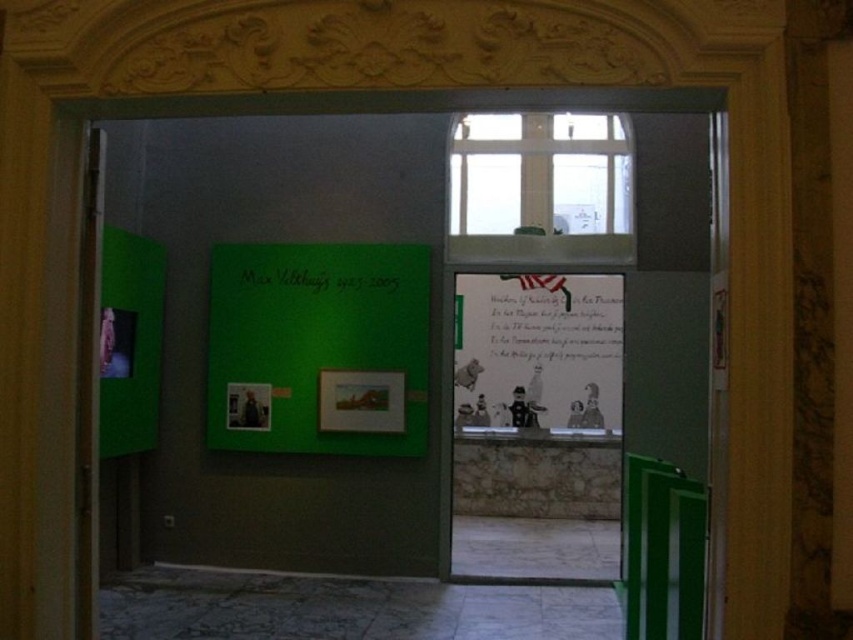
Who is lower down, handwritten paper at center or green matte sign at center?

handwritten paper at center is below.

Can you confirm if handwritten paper at center is thinner than green matte sign at center?

Incorrect, handwritten paper at center's width is not less than green matte sign at center's.

Where is `handwritten paper at center`? This screenshot has height=640, width=853. handwritten paper at center is located at coordinates (553, 321).

Who is positioned more to the left, matte paper poster at center or handwritten paper at center?

matte paper poster at center

Between matte paper poster at center and handwritten paper at center, which one is positioned lower?

matte paper poster at center is lower down.

Where is `matte paper poster at center`? This screenshot has width=853, height=640. matte paper poster at center is located at coordinates (538, 349).

This screenshot has width=853, height=640. I want to click on matte paper poster at center, so click(x=538, y=349).

Is green matte poster at center closer to camera compared to matte paper poster at center?

That is True.

How much distance is there between green matte poster at center and matte paper poster at center?

The distance of green matte poster at center from matte paper poster at center is 3.71 meters.

Between point (294, 292) and point (589, 419), which one is positioned in front?

Point (294, 292) is in front.

This screenshot has width=853, height=640. I want to click on green matte poster at center, so click(x=316, y=346).